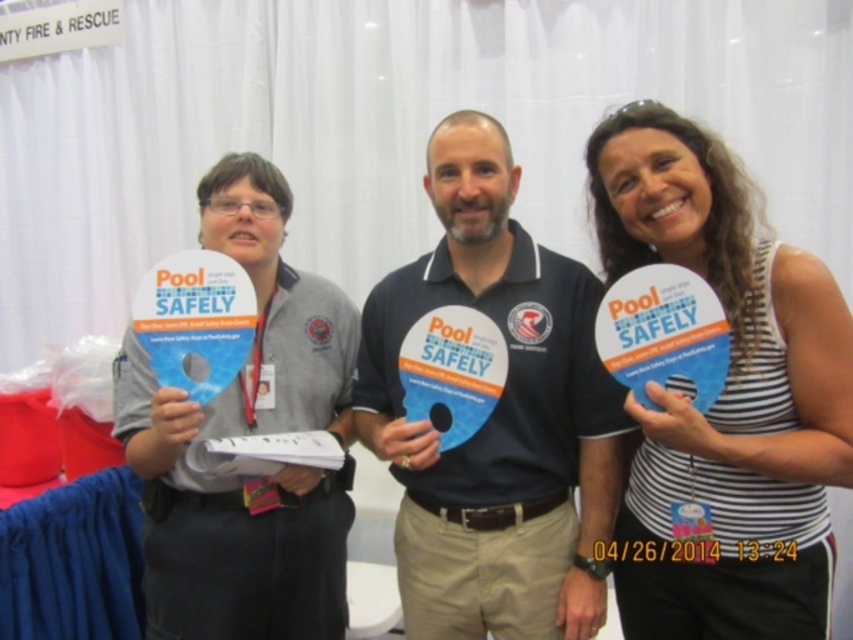
Is point (422, 556) farther from camera compared to point (328, 538)?

No, it is not.

Identify the location of matte black polo shirt at center. The width and height of the screenshot is (853, 640). (497, 417).

Can you confirm if white striped tank top at center is positioned above matte gray shirt at left?

Yes, white striped tank top at center is above matte gray shirt at left.

Does white striped tank top at center have a greater height compared to matte gray shirt at left?

Yes, white striped tank top at center is taller than matte gray shirt at left.

Describe the element at coordinates (724, 400) in the screenshot. I see `white striped tank top at center` at that location.

I want to click on white striped tank top at center, so click(724, 400).

Can you confirm if white striped tank top at center is positioned below matte black polo shirt at center?

Incorrect, white striped tank top at center is not positioned below matte black polo shirt at center.

Can you confirm if white striped tank top at center is wider than matte black polo shirt at center?

In fact, white striped tank top at center might be narrower than matte black polo shirt at center.

This screenshot has width=853, height=640. Identify the location of white striped tank top at center. [x=724, y=400].